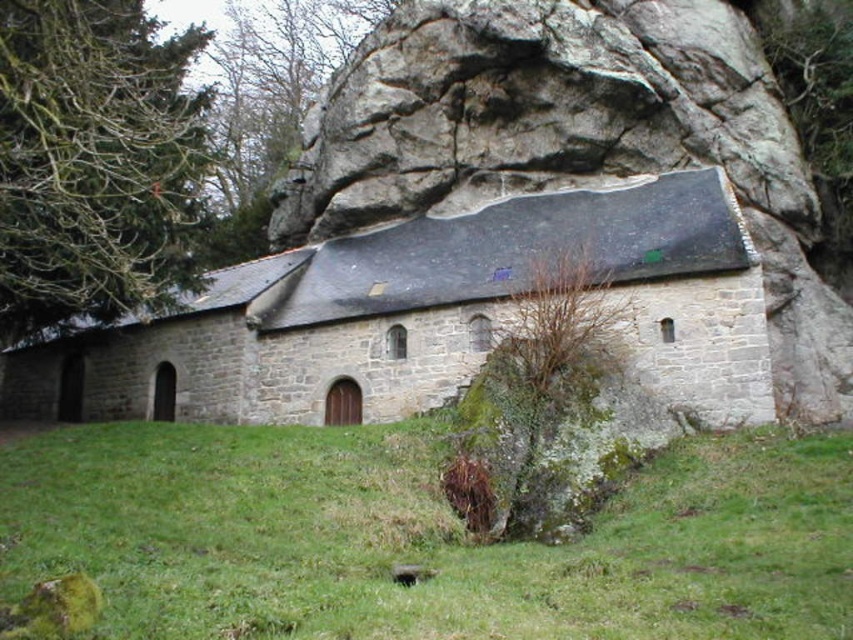
Locate an element on the screen. The height and width of the screenshot is (640, 853). green grass at lower center is located at coordinates (425, 540).

Measure the distance between green grass at lower center and camera.

green grass at lower center is 88.22 feet away from camera.

I want to click on green grass at lower center, so click(425, 540).

Is green grass at lower center taller than gray stone church at center?

No.

Describe the element at coordinates (425, 540) in the screenshot. I see `green grass at lower center` at that location.

Where is `green grass at lower center`? green grass at lower center is located at coordinates (425, 540).

Between point (289, 353) and point (65, 141), which one is positioned in front?

Point (65, 141) is in front.

Is gray stone church at center positioned in front of green leafy tree at upper left?

No, it is not.

What are the coordinates of `gray stone church at center` in the screenshot? It's located at (428, 314).

In order to click on gray stone church at center in this screenshot , I will do `click(428, 314)`.